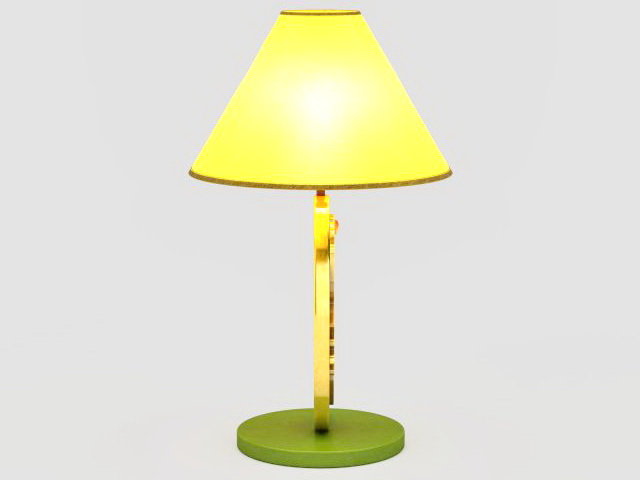
This screenshot has height=480, width=640. Identify the location of decorative trim. (324, 13), (274, 183).